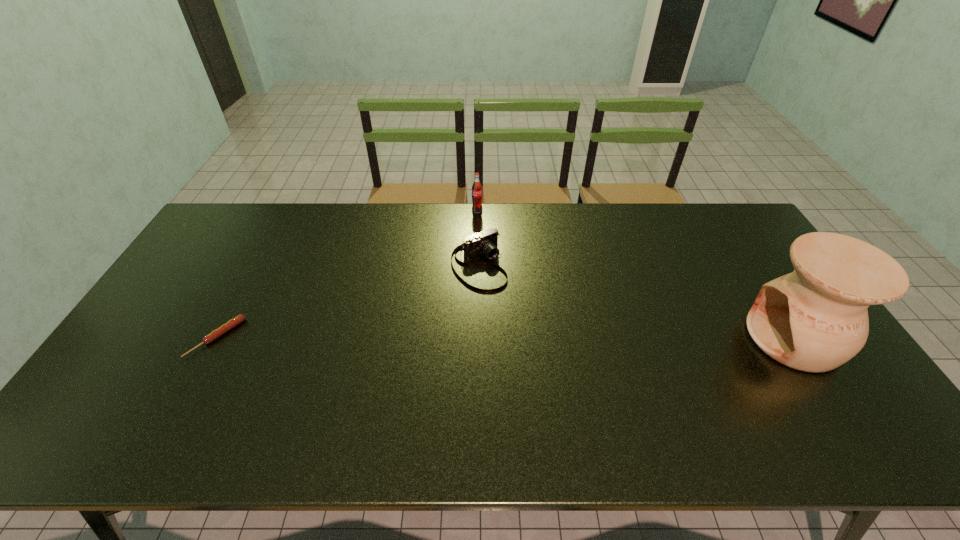
The image size is (960, 540). What are the coordinates of `object at the near edge` in the screenshot? It's located at (815, 319).

Locate an element on the screen. object that is at the right edge is located at coordinates (815, 319).

You are a GUI agent. You are given a task and a screenshot of the screen. Output one action in this format:
    pyautogui.click(x=<x>, y=<y>)
    Task: Click on the object present at the near right corner
    
    Given the screenshot: What is the action you would take?
    pyautogui.click(x=815, y=319)

Identify the location of free space at the far edge. The width and height of the screenshot is (960, 540). (560, 241).

In the image, there is a desktop. Where is `vacant space at the near edge`? The height and width of the screenshot is (540, 960). vacant space at the near edge is located at coordinates (415, 386).

In the image, there is a desktop. Where is `free space at the left edge`? The image size is (960, 540). free space at the left edge is located at coordinates (126, 355).

The width and height of the screenshot is (960, 540). In order to click on vacant space at the right edge of the desktop in this screenshot , I will do `click(726, 248)`.

Where is `vacant space at the far left corner`? The image size is (960, 540). vacant space at the far left corner is located at coordinates click(252, 218).

The image size is (960, 540). I want to click on free spot between the third tallest object and the tallest object, so click(636, 301).

The width and height of the screenshot is (960, 540). I want to click on vacant area that lies between the tallest object and the camera, so click(x=636, y=301).